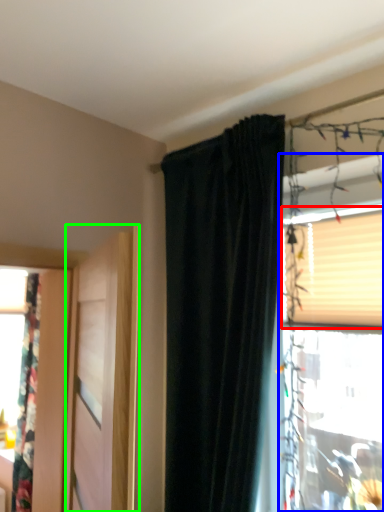
Question: Considering the real-world distances, which object is closest to blind (highlighted by a red box)? window (highlighted by a blue box) or door (highlighted by a green box).

Choices:
 (A) window
 (B) door

Answer: (A)